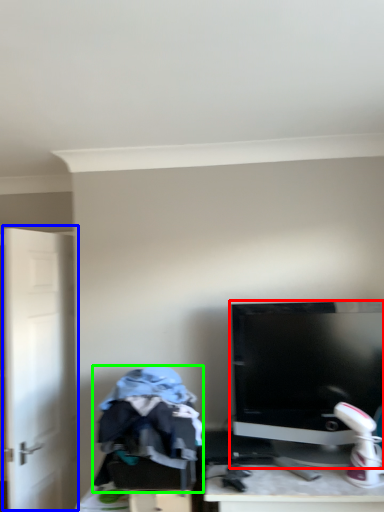
Question: Which object is the farthest from computer monitor (highlighted by a red box)? Choose among these: door (highlighted by a blue box) or clothing (highlighted by a green box).

Choices:
 (A) door
 (B) clothing

Answer: (A)